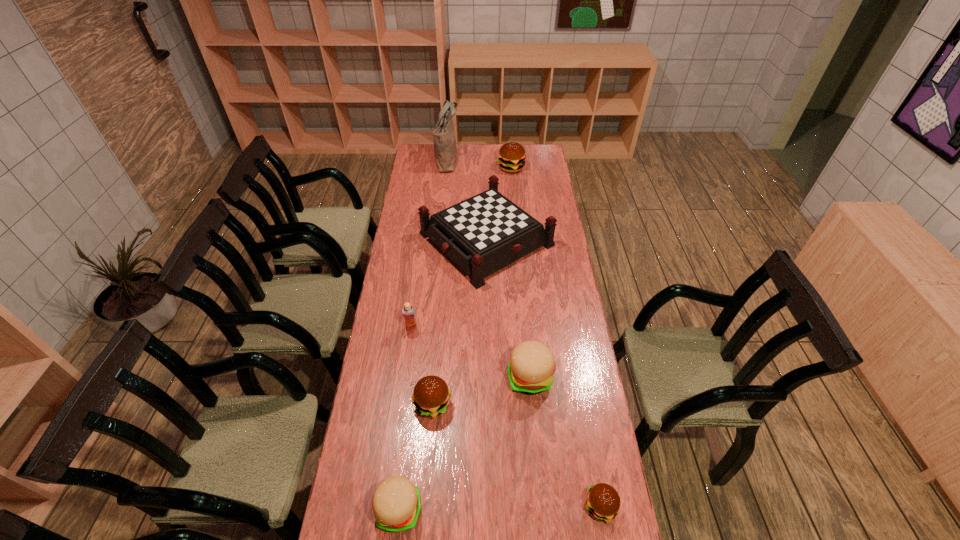
Find the location of a particular element. The image size is (960, 540). the second biggest brown hamburger is located at coordinates (431, 396).

You are a GUI agent. You are given a task and a screenshot of the screen. Output one action in this format:
    pyautogui.click(x=<x>, y=<y>)
    Task: Click on the smaller beige hamburger
    The image size is (960, 540).
    Given the screenshot: What is the action you would take?
    pyautogui.click(x=396, y=501)

Identify the location of the left beige hamburger. click(396, 501).

Identify the location of the nearest brown hamburger. (603, 502).

In order to click on the shortest object in this screenshot , I will do `click(603, 502)`.

At what (x,y) coordinates should I click in order to perform the action: click on vacant space located 0.110m on the front-facing side of the tallest object. Please return your answer as a coordinate pair (x, y). The height and width of the screenshot is (540, 960). Looking at the image, I should click on 478,159.

Find the location of a particular element. vacant space situated 0.270m on the front of the checkerboard is located at coordinates (488, 342).

Where is `free region located on the back of the second brown hamburger from left to right`? The image size is (960, 540). free region located on the back of the second brown hamburger from left to right is located at coordinates point(510,144).

Identify the location of free spot located on the front of the farther beige hamburger. (536, 437).

Where is `vacant space located on the back of the fourth farthest object`? vacant space located on the back of the fourth farthest object is located at coordinates (414, 312).